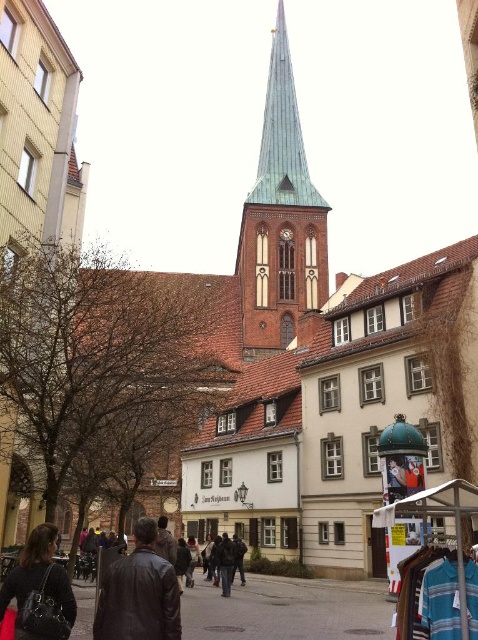
Question: Among these objects, which one is nearest to the camera?

Choices:
 (A) matte black jacket at lower left
 (B) leather jacket at center
 (C) green copper spire at center

Answer: (B)

Question: Which point appears closest to the camera in this image?

Choices:
 (A) (306, 296)
 (B) (29, 609)

Answer: (B)

Question: Does leather jacket at center appear on the left side of matte black jacket at lower left?

Choices:
 (A) yes
 (B) no

Answer: (B)

Question: Is leather jacket at center behind matte black jacket at lower left?

Choices:
 (A) yes
 (B) no

Answer: (B)

Question: Which of the following is the farthest from the observer?

Choices:
 (A) matte black jacket at lower left
 (B) green copper spire at center

Answer: (B)

Question: Can you confirm if green copper spire at center is smaller than matte black jacket at lower left?

Choices:
 (A) no
 (B) yes

Answer: (A)